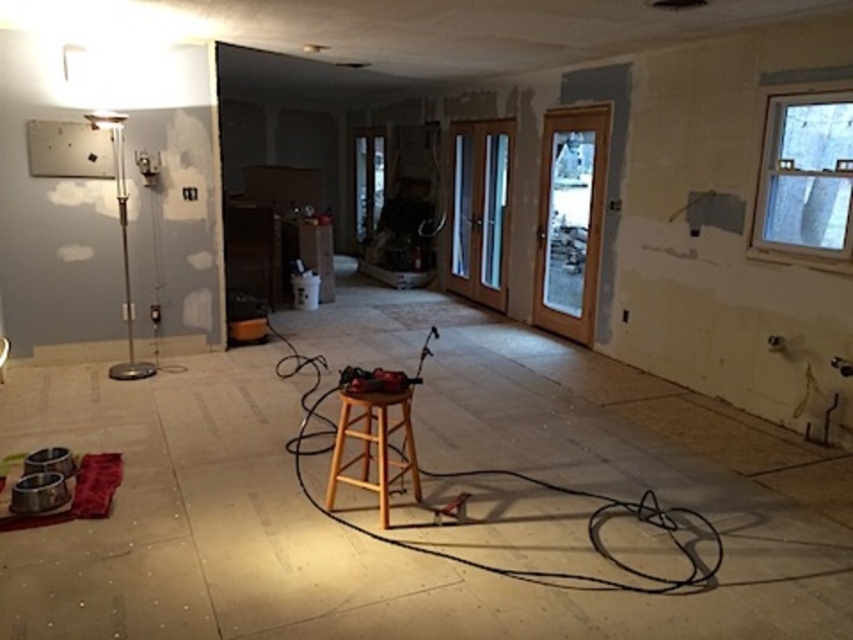
Is black cable at center below wooden bar stool at center?

No.

Between black cable at center and wooden bar stool at center, which one is positioned lower?

Positioned lower is wooden bar stool at center.

Measure the distance between point (637,515) and camera.

Point (637,515) and camera are 10.97 feet apart from each other.

Image resolution: width=853 pixels, height=640 pixels. I want to click on black cable at center, so click(494, 474).